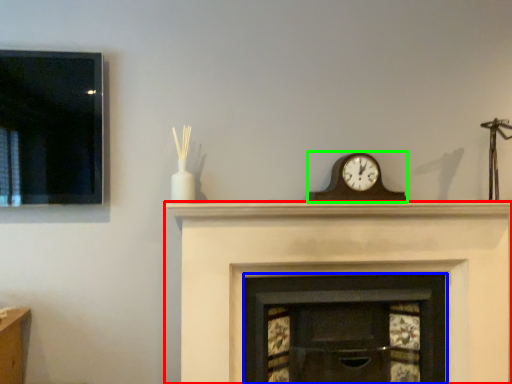
Question: Which is farther away from fireplace (highlighted by a red box)? fireplace (highlighted by a blue box) or wall clock (highlighted by a green box)?

Choices:
 (A) fireplace
 (B) wall clock

Answer: (B)